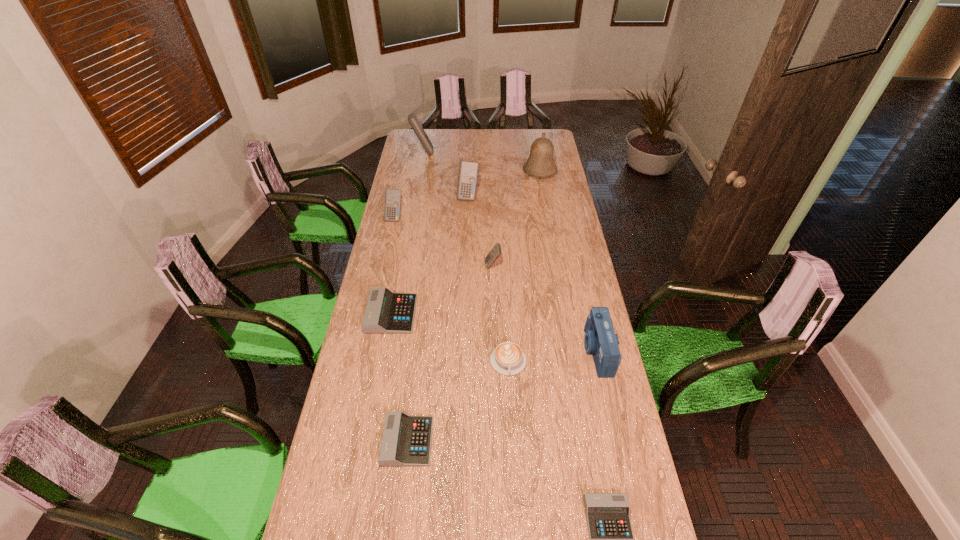
Identify the location of the third nearest calculator. This screenshot has height=540, width=960. (386, 312).

The height and width of the screenshot is (540, 960). Find the location of `the biggest gray calculator`. the biggest gray calculator is located at coordinates (386, 312).

Locate an element on the screen. This screenshot has width=960, height=540. cappuccino is located at coordinates (x=507, y=358).

I want to click on the sixth farthest calculator, so click(x=406, y=441).

Locate an element on the screen. the ninth farthest object is located at coordinates (406, 441).

Where is `free space located on the front-facing side of the farthest object`? The height and width of the screenshot is (540, 960). free space located on the front-facing side of the farthest object is located at coordinates (458, 152).

Identify the location of vacant area located 0.310m on the left of the second farthest object. The image size is (960, 540). (468, 171).

Find the location of a particular element. free space located on the front-facing side of the second farthest blue calculator is located at coordinates (467, 230).

The height and width of the screenshot is (540, 960). I want to click on free space located 0.300m on the front-facing side of the third farthest calculator, so click(x=384, y=267).

The image size is (960, 540). Find the location of `free space located 0.290m on the lens of the camera`. free space located 0.290m on the lens of the camera is located at coordinates (505, 351).